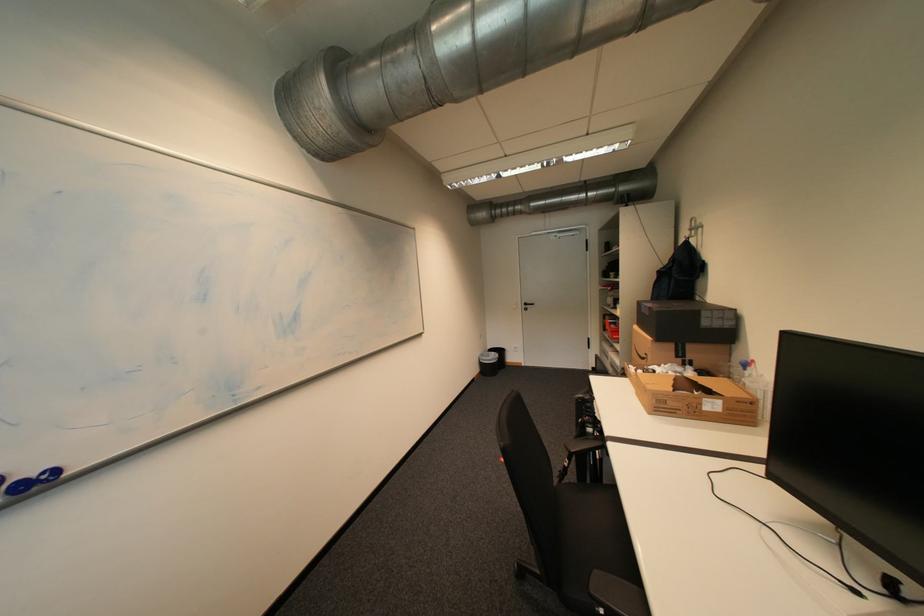
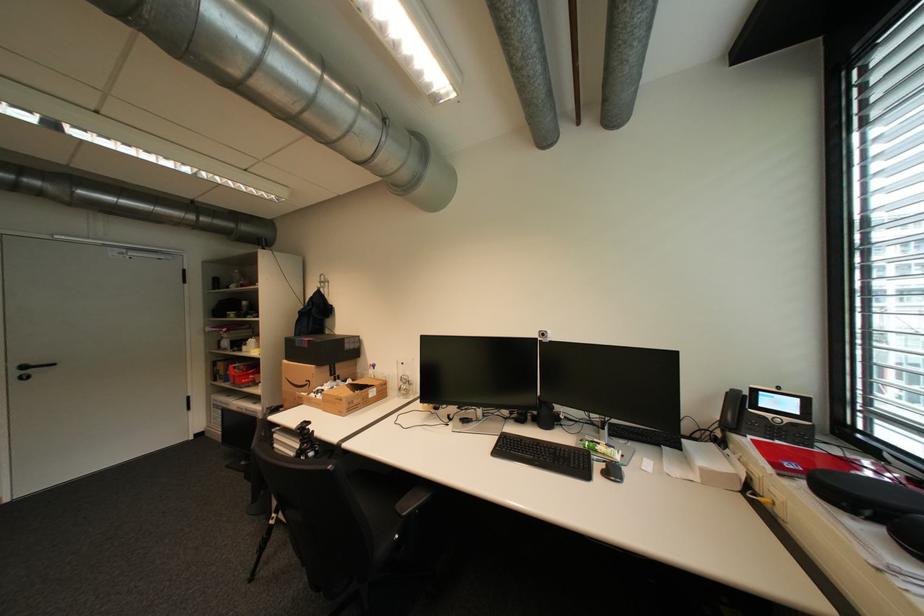
Where in the second image is the point corresponding to (x=533, y=305) from the first image?

(32, 368)